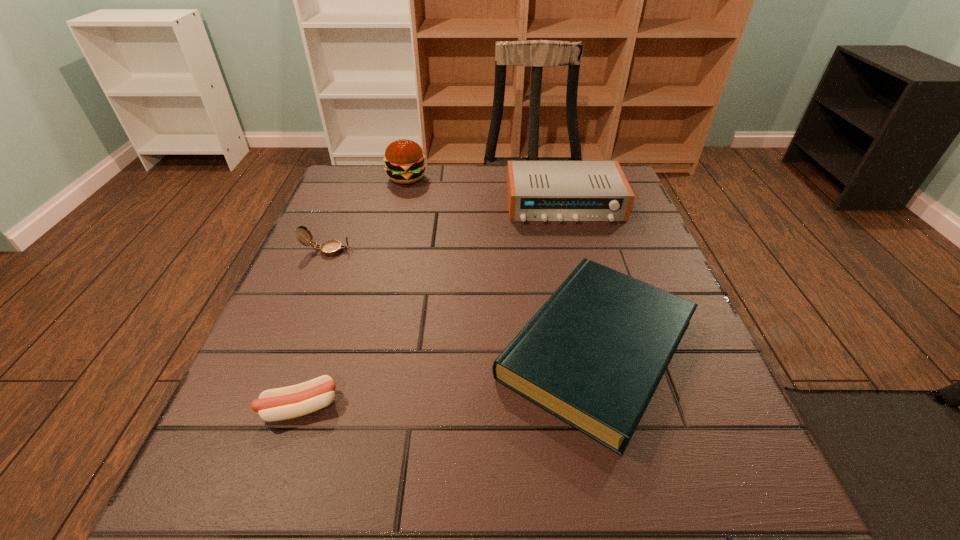
Identify the location of hamburger positioned at the far edge. Image resolution: width=960 pixels, height=540 pixels. (404, 159).

Identify the location of radio receiver that is at the far edge. tap(560, 191).

Locate an element on the screen. Image resolution: width=960 pixels, height=540 pixels. hamburger that is at the left edge is located at coordinates (404, 159).

This screenshot has height=540, width=960. I want to click on compass located at the left edge, so click(330, 248).

Where is `sausage located in the left edge section of the desktop`? sausage located in the left edge section of the desktop is located at coordinates coord(284,403).

Where is `radio receiver at the right edge`? radio receiver at the right edge is located at coordinates (560, 191).

Locate an element on the screen. The height and width of the screenshot is (540, 960). book at the right edge is located at coordinates (593, 355).

Identify the location of object that is at the far left corner. This screenshot has height=540, width=960. (404, 159).

Where is `object at the far right corner`? The height and width of the screenshot is (540, 960). object at the far right corner is located at coordinates (560, 191).

Find the location of a particular element. vacant space at the far edge of the desktop is located at coordinates (488, 173).